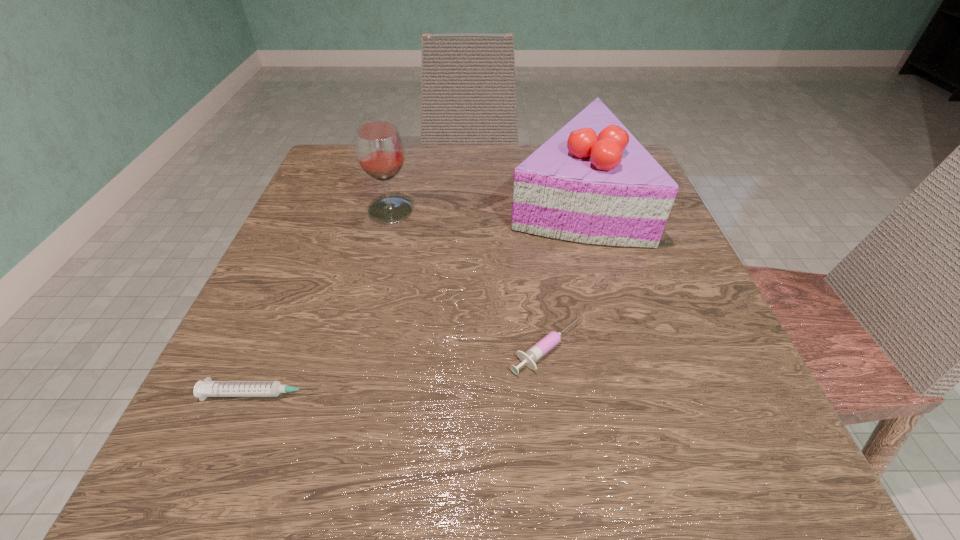
This screenshot has width=960, height=540. I want to click on free location at the right edge of the desktop, so click(x=769, y=417).

You are a GUI agent. You are given a task and a screenshot of the screen. Output one action in this format:
    pyautogui.click(x=<x>, y=<y>)
    Task: Click on the vacant space at the far left corner of the desktop
    The image size is (960, 540).
    Given the screenshot: What is the action you would take?
    pyautogui.click(x=354, y=187)

In the image, there is a desktop. Where is `vacant space at the near left corner`? vacant space at the near left corner is located at coordinates (185, 438).

At what (x,y) coordinates should I click in order to perform the action: click on free space at the near right corner. Please return your answer as a coordinate pair (x, y). The width and height of the screenshot is (960, 540). Looking at the image, I should click on (657, 447).

Where is `vacant area that lies between the nearest object and the right syringe`? The width and height of the screenshot is (960, 540). vacant area that lies between the nearest object and the right syringe is located at coordinates (404, 371).

The height and width of the screenshot is (540, 960). I want to click on free space between the farther syringe and the nearer syringe, so [x=404, y=371].

Locate an element on the screen. empty location between the right syringe and the cake is located at coordinates (559, 271).

The image size is (960, 540). Find the location of `unoccupied area between the left syringe and the right syringe`. unoccupied area between the left syringe and the right syringe is located at coordinates (404, 371).

Locate an element on the screen. Image resolution: width=960 pixels, height=540 pixels. free area in between the farther syringe and the nearest object is located at coordinates (404, 371).

Locate an element on the screen. This screenshot has height=540, width=960. vacant space that is in between the wineglass and the farther syringe is located at coordinates (468, 280).